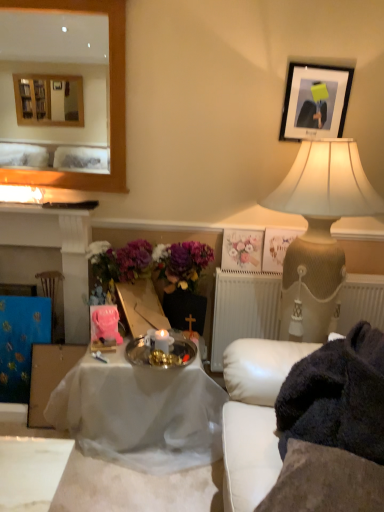
What is the approximate width of silver metallic tray at center?

15.65 inches.

Locate an element on the screen. The width and height of the screenshot is (384, 512). silver metallic tray at center is located at coordinates (161, 352).

What is the approximate width of white cloth-covered table at center?

white cloth-covered table at center is 28.59 inches in width.

What do you see at coordinates (244, 310) in the screenshot? I see `white textured radiator at center` at bounding box center [244, 310].

This screenshot has width=384, height=512. I want to click on beige textured lamp at upper right, so click(x=320, y=231).

At what (x,y) coordinates should I click in order to perform the action: click on wooden frame mirror at upper left. Please return your answer as a coordinate pair (x, y). Looking at the image, I should click on (110, 99).

Which of these two, wooden frame mirror at upper left or white textured radiator at center, is wider?

With larger width is white textured radiator at center.

Is point (122, 98) positioned in front of point (239, 316)?

Yes, point (122, 98) is closer to viewer.

Image resolution: width=384 pixels, height=512 pixels. In order to click on mirror on the left side of white textured radiator at center in this screenshot , I will do `click(110, 99)`.

How distant is wooden frame mirror at upper left from white textured radiator at center?

wooden frame mirror at upper left and white textured radiator at center are 38.02 inches apart.

Considering the sizes of objects wooden frame mirror at upper left and silver metallic tray at center in the image provided, who is wider, wooden frame mirror at upper left or silver metallic tray at center?

silver metallic tray at center.

Considering the relative sizes of wooden frame mirror at upper left and silver metallic tray at center in the image provided, is wooden frame mirror at upper left shorter than silver metallic tray at center?

In fact, wooden frame mirror at upper left may be taller than silver metallic tray at center.

Can you tell me how much wooden frame mirror at upper left and silver metallic tray at center differ in facing direction?

The angular difference between wooden frame mirror at upper left and silver metallic tray at center is 0.0062 degrees.

Is wooden frame mirror at upper left next to silver metallic tray at center?

No, wooden frame mirror at upper left is not touching silver metallic tray at center.

Is matte black fireplace at left located outside white leather couch at right?

Yes.

Considering their positions, is matte black fireplace at left located in front of or behind white leather couch at right?

matte black fireplace at left is positioned farther from the viewer than white leather couch at right.

From the image's perspective, which is above, matte black fireplace at left or white leather couch at right?

matte black fireplace at left.

At what (x,y) coordinates should I click in order to perform the action: click on studio couch in front of the matte black fireplace at left. Please return your answer as a coordinate pair (x, y). The width and height of the screenshot is (384, 512). Looking at the image, I should click on (309, 425).

In the scene shown: Is matte black fireplace at left looking in the opposite direction of beige textured lamp at upper right?

That's not correct — matte black fireplace at left is not looking away from beige textured lamp at upper right.

Is matte black fireplace at left not near beige textured lamp at upper right?

Yes, matte black fireplace at left and beige textured lamp at upper right are quite far apart.

I want to click on lamp beneath the matte black fireplace at left (from a real-world perspective), so click(x=320, y=231).

Is point (146, 353) more distant than point (122, 66)?

That is False.

Based on their positions, is silver metallic tray at center located to the left or right of wooden frame mirror at upper left?

silver metallic tray at center is positioned on wooden frame mirror at upper left's right side.

Looking at this image, does silver metallic tray at center have a lesser width compared to wooden frame mirror at upper left?

No.

Is silver metallic tray at center placed right next to wooden frame mirror at upper left?

No, silver metallic tray at center is not next to wooden frame mirror at upper left.

Is point (143, 348) positioned after point (340, 247)?

No, it is in front of (340, 247).

Are silver metallic tray at center and beige textured lamp at upper right beside each other?

silver metallic tray at center and beige textured lamp at upper right are clearly separated.

Is silver metallic tray at center behind beige textured lamp at upper right?

Yes, silver metallic tray at center is further from the camera.

Locate an element on the screen. This screenshot has width=384, height=512. lamp on the right of silver metallic tray at center is located at coordinates (320, 231).

Is white cloth-covered table at center wider than wooden picture frame at upper right, marked as the 1th picture frame in a back-to-front arrangement?

Yes.

Find the location of a particular element. table located on the left of wooden picture frame at upper right, marked as the 1th picture frame in a back-to-front arrangement is located at coordinates (140, 413).

Which is in front, point (152, 399) or point (279, 228)?

The point (152, 399) is closer.

Is white cloth-covered table at center taller or shorter than wooden picture frame at upper right, which is counted as the 2th picture frame, starting from the top?

Clearly, white cloth-covered table at center is taller compared to wooden picture frame at upper right, which is counted as the 2th picture frame, starting from the top.

What are the coordinates of `mirror lying on the left of white textured radiator at center` in the screenshot? It's located at (110, 99).

Where is `round table on the right of wooden frame mirror at upper left`? The height and width of the screenshot is (512, 384). round table on the right of wooden frame mirror at upper left is located at coordinates coord(161,352).

From the image, which object appears to be farther from black matte picture frame at upper right, the 1th picture frame positioned from the top, matte black fireplace at left or white textured radiator at center?

matte black fireplace at left is positioned further to the anchor black matte picture frame at upper right, the 1th picture frame positioned from the top.

Estimate the real-world distances between objects in this image. Which object is closer to matte black fireplace at left, blue fabric tablecloth at left or black matte picture frame at upper right, which is the 2th picture frame from back to front?

blue fabric tablecloth at left is positioned closer to the anchor matte black fireplace at left.

Looking at the image, which one is located further to beige textured lamp at upper right, white cloth-covered table at center or white leather couch at right?

The object further to beige textured lamp at upper right is white cloth-covered table at center.

From the image, which object appears to be farther from matte black fireplace at left, wooden picture frame at upper right, the 1th picture frame in the bottom-to-top sequence, or white textured radiator at center?

wooden picture frame at upper right, the 1th picture frame in the bottom-to-top sequence.

When comparing their distances from pastel floral print at upper center, does white textured radiator at center or white leather couch at right seem further?

The object further to pastel floral print at upper center is white leather couch at right.

Which object lies nearer to the anchor point black matte picture frame at upper right, the 1th picture frame in the front-to-back sequence, white cloth-covered table at center or silver metallic tray at center?

The object closer to black matte picture frame at upper right, the 1th picture frame in the front-to-back sequence, is silver metallic tray at center.

Estimate the real-world distances between objects in this image. Which object is further from white leather couch at right, white cloth-covered table at center or pastel floral print at upper center?

pastel floral print at upper center is further to white leather couch at right.

Based on their spatial positions, is black matte picture frame at upper right, the 1th picture frame positioned from the top, or wooden picture frame at upper right, marked as the 1th picture frame in a back-to-front arrangement, closer to pastel floral print at upper center?

wooden picture frame at upper right, marked as the 1th picture frame in a back-to-front arrangement, is positioned closer to the anchor pastel floral print at upper center.

Find the location of a particular element. table between matte black fireplace at left and wooden picture frame at upper right, which is the 2th picture frame from front to back, from left to right is located at coordinates (140, 413).

Locate an element on the screen. This screenshot has height=512, width=384. radiator between blue fabric tablecloth at left and beige textured lamp at upper right from left to right is located at coordinates (244, 310).

I want to click on tablecloth that lies between wooden frame mirror at upper left and dark gray fabric at lower right from top to bottom, so [21, 342].

Identify the location of table located between blue fabric tablecloth at left and beige textured lamp at upper right in the left-right direction. Image resolution: width=384 pixels, height=512 pixels. (140, 413).